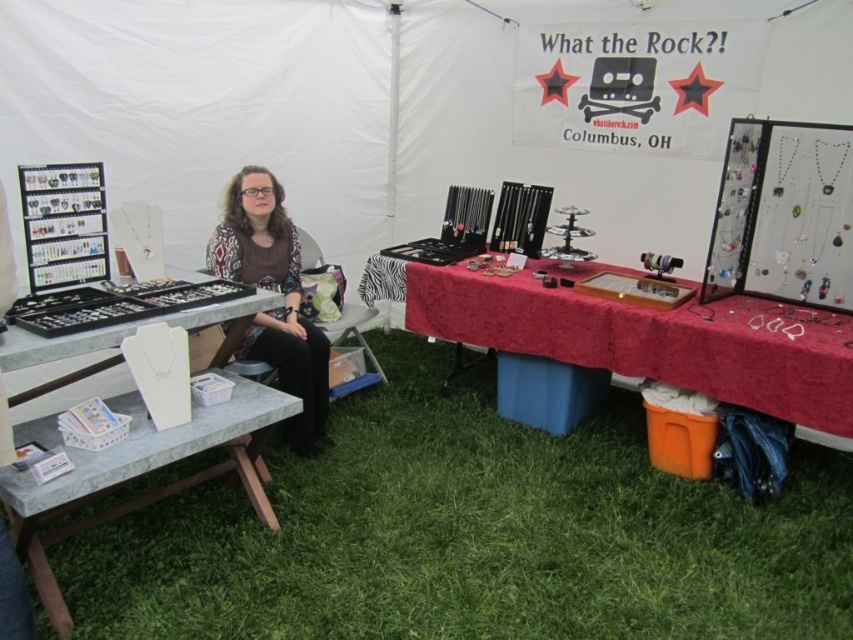
Question: Estimate the real-world distances between objects in this image. Which object is closer to the matte black sweater at center?

Choices:
 (A) metallic gray table at lower left
 (B) green grass at lower center

Answer: (A)

Question: Does green grass at lower center have a larger size compared to velvet red table at center?

Choices:
 (A) yes
 (B) no

Answer: (A)

Question: Which point is farther to the camera?

Choices:
 (A) metallic gray table at lower left
 (B) green grass at lower center

Answer: (B)

Question: Considering the relative positions of velvet red table at center and metallic gray table at lower left in the image provided, where is velvet red table at center located with respect to metallic gray table at lower left?

Choices:
 (A) right
 (B) left

Answer: (A)

Question: Is green grass at lower center thinner than matte black sweater at center?

Choices:
 (A) yes
 (B) no

Answer: (B)

Question: Estimate the real-world distances between objects in this image. Which object is farther from the velvet red table at center?

Choices:
 (A) matte black sweater at center
 (B) metallic gray table at lower left

Answer: (B)